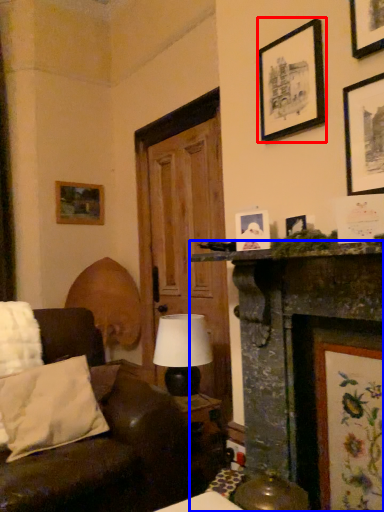
Question: Which point is further to the camera, picture frame (highlighted by a red box) or fireplace (highlighted by a blue box)?

Choices:
 (A) picture frame
 (B) fireplace

Answer: (A)